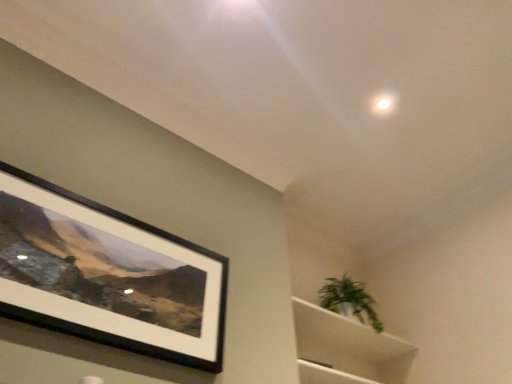
Question: Could you tell me if black matte picture frame at upper left is facing green leafy plant at upper right?

Choices:
 (A) no
 (B) yes

Answer: (A)

Question: Is green leafy plant at upper right at the back of black matte picture frame at upper left?

Choices:
 (A) no
 (B) yes

Answer: (A)

Question: From the image's perspective, would you say black matte picture frame at upper left is positioned over green leafy plant at upper right?

Choices:
 (A) no
 (B) yes

Answer: (B)

Question: From the image's perspective, is black matte picture frame at upper left below green leafy plant at upper right?

Choices:
 (A) no
 (B) yes

Answer: (A)

Question: Can you confirm if black matte picture frame at upper left is wider than green leafy plant at upper right?

Choices:
 (A) no
 (B) yes

Answer: (A)

Question: Does black matte picture frame at upper left contain green leafy plant at upper right?

Choices:
 (A) no
 (B) yes

Answer: (A)

Question: Is green leafy plant at upper right to the right of black matte picture frame at upper left from the viewer's perspective?

Choices:
 (A) no
 (B) yes

Answer: (B)

Question: Can you confirm if green leafy plant at upper right is bigger than black matte picture frame at upper left?

Choices:
 (A) yes
 (B) no

Answer: (A)

Question: Considering the relative sizes of green leafy plant at upper right and black matte picture frame at upper left in the image provided, is green leafy plant at upper right thinner than black matte picture frame at upper left?

Choices:
 (A) yes
 (B) no

Answer: (B)

Question: Does green leafy plant at upper right appear on the left side of black matte picture frame at upper left?

Choices:
 (A) yes
 (B) no

Answer: (B)

Question: Does green leafy plant at upper right have a lesser height compared to black matte picture frame at upper left?

Choices:
 (A) no
 (B) yes

Answer: (B)

Question: From a real-world perspective, does green leafy plant at upper right stand above black matte picture frame at upper left?

Choices:
 (A) yes
 (B) no

Answer: (A)

Question: Considering the relative positions of green leafy plant at upper right and white matte cabinet at lower right in the image provided, is green leafy plant at upper right to the left of white matte cabinet at lower right from the viewer's perspective?

Choices:
 (A) yes
 (B) no

Answer: (B)